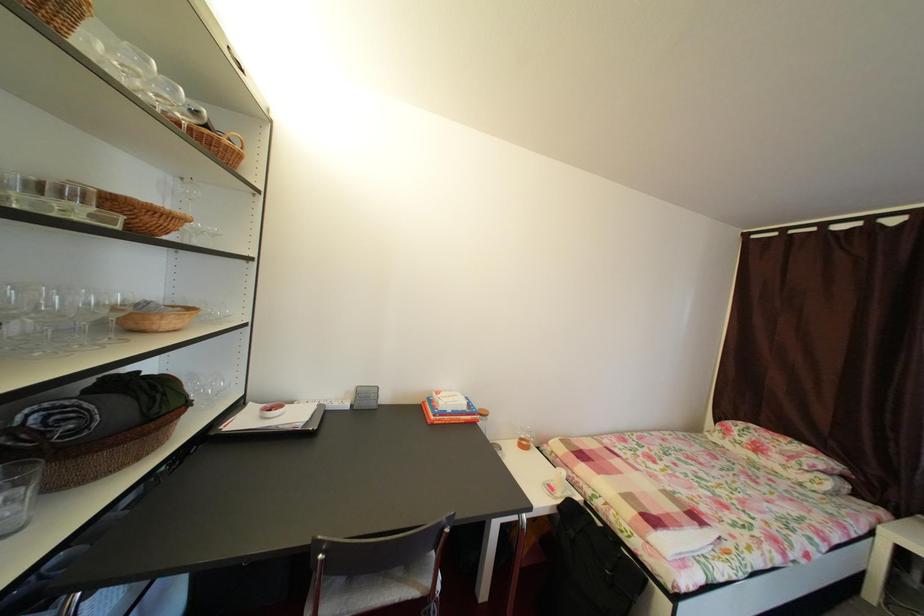
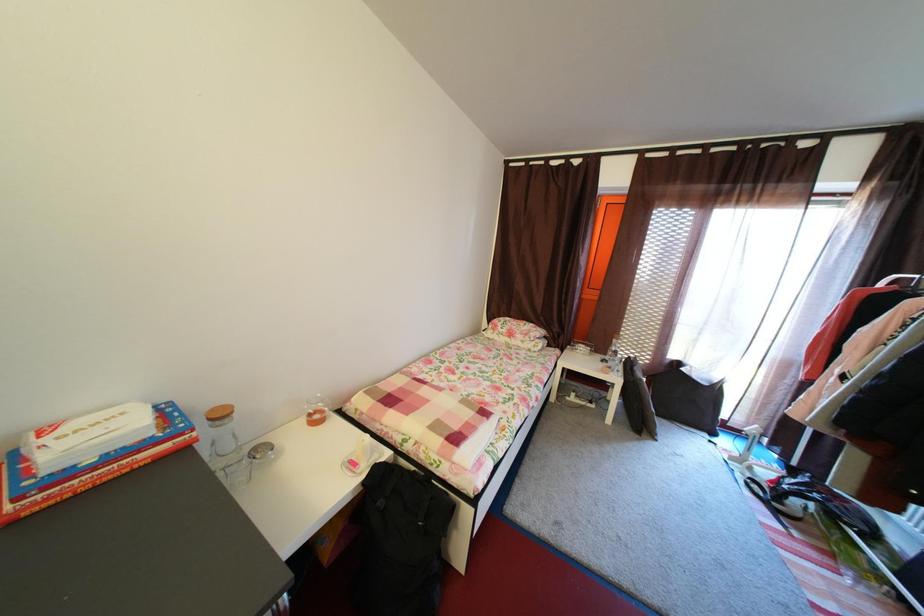
The first image is from the beginning of the video and the second image is from the end. How did the camera likely rotate when shooting the video?

The camera's rotation is toward right-down.